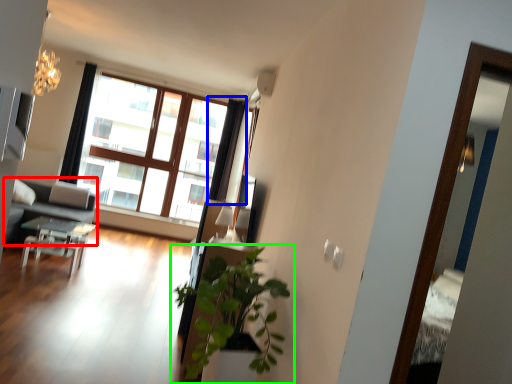
Question: Based on their relative distances, which object is nearer to studio couch (highlighted by a red box)? Choose from curtain (highlighted by a blue box) and houseplant (highlighted by a green box).

Choices:
 (A) curtain
 (B) houseplant

Answer: (A)